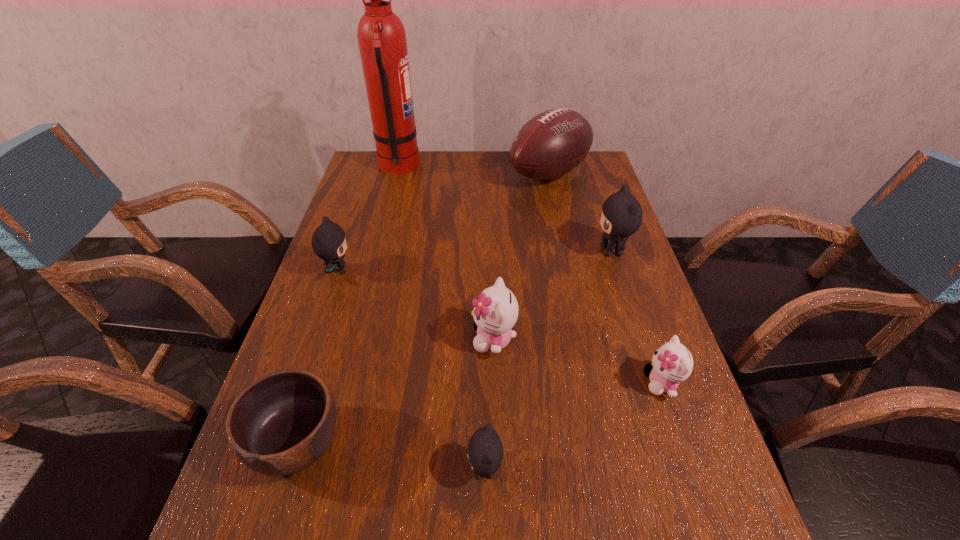
The image size is (960, 540). I want to click on bowl present at the left edge, so click(x=282, y=423).

This screenshot has height=540, width=960. Identify the location of football (American) located at the right edge. (552, 143).

The width and height of the screenshot is (960, 540). What are the coordinates of `object that is positioned at the far left corner` in the screenshot? It's located at (381, 36).

Find the location of a particular element. The image size is (960, 540). object that is at the far right corner is located at coordinates (552, 143).

Image resolution: width=960 pixels, height=540 pixels. What are the coordinates of `free space at the far edge of the desktop` in the screenshot? It's located at (456, 167).

Identify the location of free point at the left edge. (370, 310).

Locate an element on the screen. vacant space at the right edge of the desktop is located at coordinates (595, 279).

You are a GUI agent. You are given a task and a screenshot of the screen. Output one action in this format:
    pyautogui.click(x=<x>, y=<y>)
    Task: Click on the free area in between the seventh shortest object and the rightmost gray kitten
    The width and height of the screenshot is (960, 540).
    Given the screenshot: What is the action you would take?
    pyautogui.click(x=580, y=213)

The width and height of the screenshot is (960, 540). Find the location of `free area in between the rightmost gray kitten and the leftmost kitten`. free area in between the rightmost gray kitten and the leftmost kitten is located at coordinates (475, 260).

Identify the location of free space that is in between the right white kitten and the second gray kitten from right to left. The image size is (960, 540). 573,426.